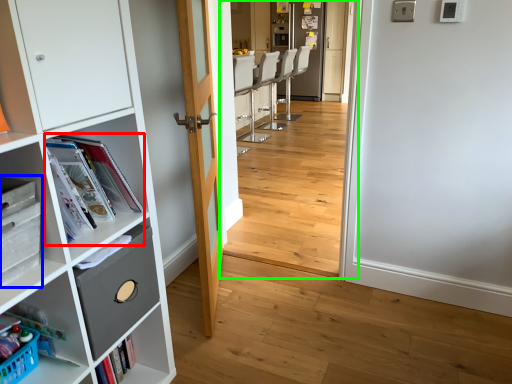
Question: Estimate the real-world distances between objects in this image. Which object is farther from magazine (highlighted by a red box), cabinetry (highlighted by a blue box) or corridor (highlighted by a green box)?

Choices:
 (A) cabinetry
 (B) corridor

Answer: (B)